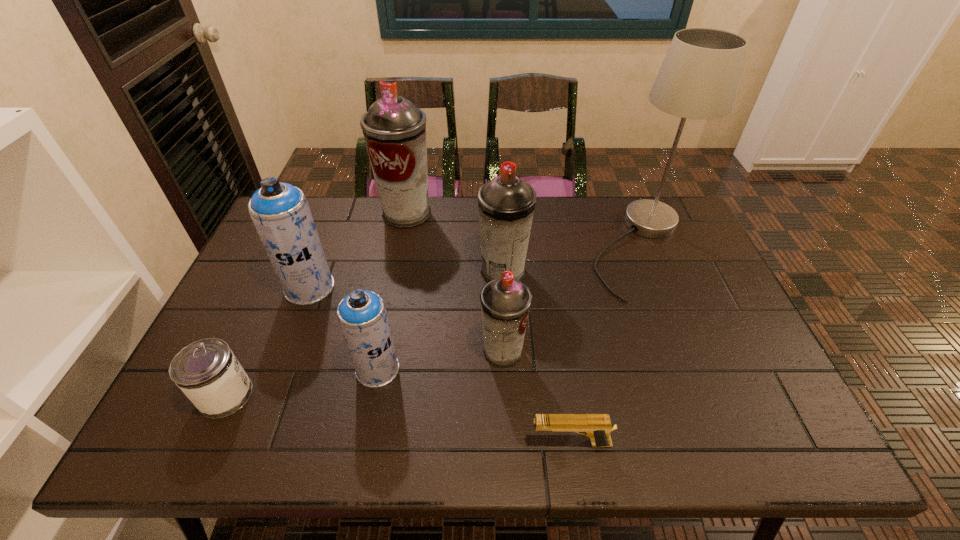
Where is `object that is at the near left corner`? The height and width of the screenshot is (540, 960). object that is at the near left corner is located at coordinates (206, 371).

Image resolution: width=960 pixels, height=540 pixels. I want to click on object at the far right corner, so click(698, 79).

Locate an element on the screen. blank area at the far edge is located at coordinates [x=553, y=206].

Where is `vacant space at the near edge`? vacant space at the near edge is located at coordinates (349, 433).

Image resolution: width=960 pixels, height=540 pixels. In order to click on free location at the left edge in this screenshot , I will do `click(267, 291)`.

Where is `free spot at the right edge of the desktop`? The height and width of the screenshot is (540, 960). free spot at the right edge of the desktop is located at coordinates (732, 402).

Find the location of a particular element. vacant point at the far left corner is located at coordinates pos(309,197).

The width and height of the screenshot is (960, 540). Identify the location of free spot between the rightmost object and the second biggest gray aerosol can. (572, 260).

Locate an element on the screen. This screenshot has height=540, width=960. free area in between the second biggest gray aerosol can and the white table lamp is located at coordinates (572, 260).

Where is `blank region between the smallest gray aerosol can and the tallest object`? blank region between the smallest gray aerosol can and the tallest object is located at coordinates (572, 300).